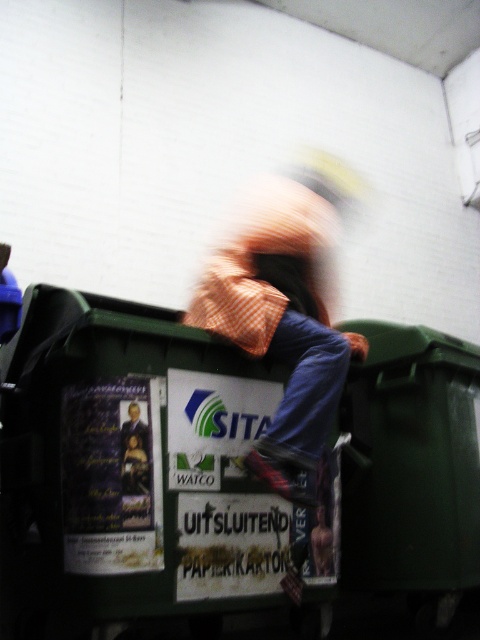
Question: Is green plastic bin at center positioned in front of orange checkered shirt at center?

Choices:
 (A) yes
 (B) no

Answer: (A)

Question: Does green plastic bin at center have a larger size compared to orange checkered shirt at center?

Choices:
 (A) yes
 (B) no

Answer: (A)

Question: Which object appears closest to the camera in this image?

Choices:
 (A) green plastic bin at center
 (B) orange checkered shirt at center

Answer: (A)

Question: Which point appears farthest from the camera in this image?

Choices:
 (A) (380, 380)
 (B) (340, 337)

Answer: (A)

Question: Is green plastic bin at center to the right of orange checkered shirt at center from the viewer's perspective?

Choices:
 (A) yes
 (B) no

Answer: (B)

Question: Which object is farther from the camera taking this photo?

Choices:
 (A) green plastic bin at center
 (B) orange checkered shirt at center

Answer: (B)